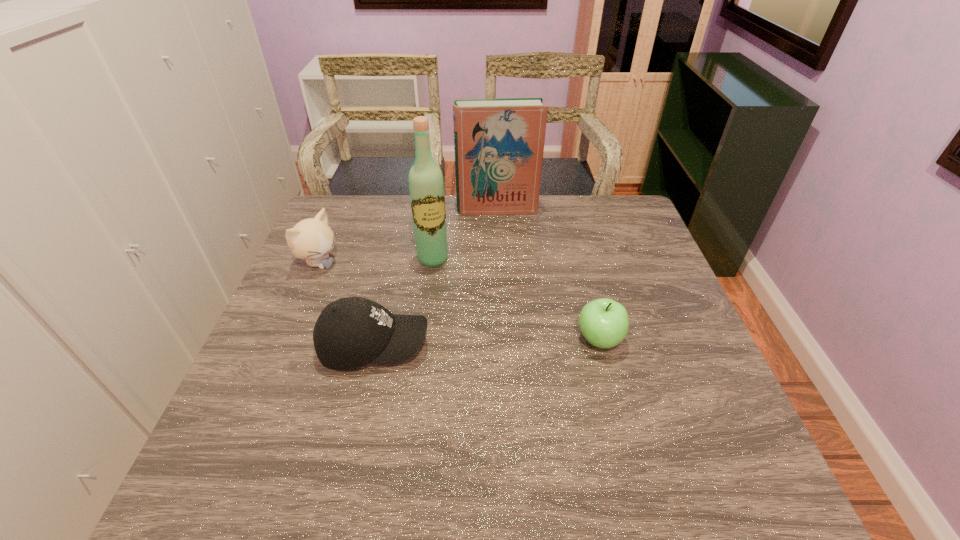
This screenshot has width=960, height=540. What are the coordinates of `free space on the desktop that is between the baseball cap and the rightmost object and is positioned on the front-facing side of the wine bottle` in the screenshot? It's located at (458, 343).

Identify the location of free spot on the desktop that is between the baseball cap and the apple and is positioned on the cover of the fourth shortest object. This screenshot has height=540, width=960. (515, 342).

Identify the location of vacant space on the desktop that is between the baseball cap and the apple and is positioned on the face of the third tallest object. (468, 343).